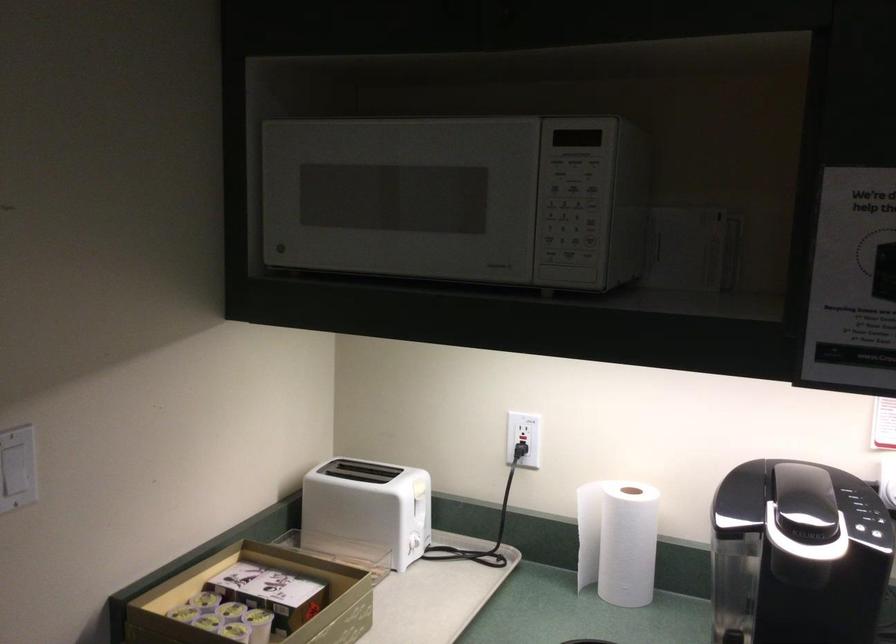
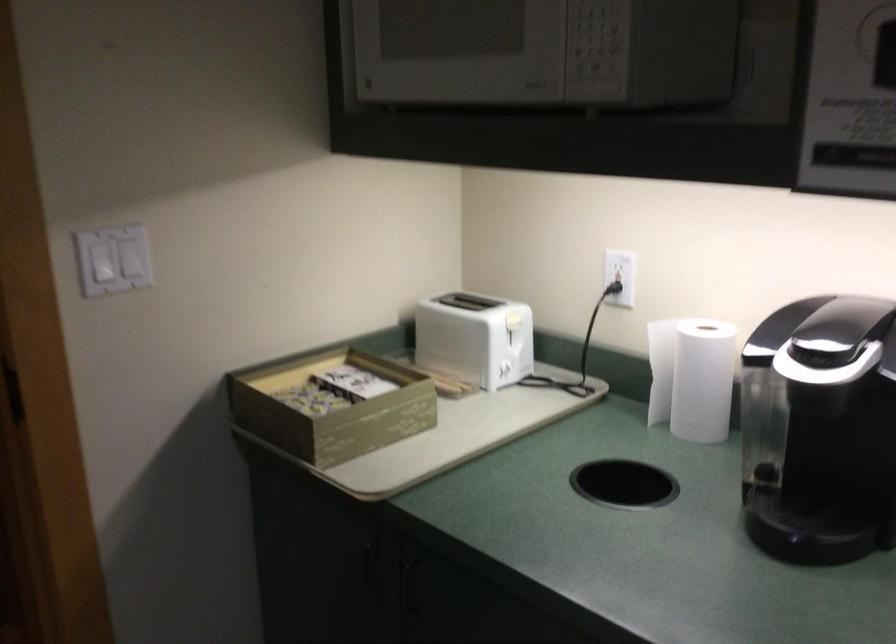
Question: The camera is either moving clockwise (left) or counter-clockwise (right) around the object. The first image is from the beginning of the video and the second image is from the end. Is the camera moving left or right when shooting the video?

Choices:
 (A) Left
 (B) Right

Answer: (B)